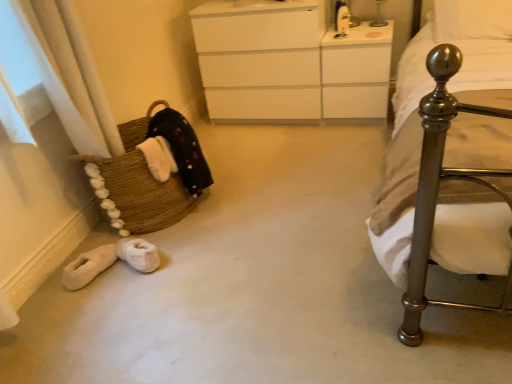
Locate an element on the screen. The height and width of the screenshot is (384, 512). vacant area that is in front of white matte chest of drawers at center is located at coordinates (284, 149).